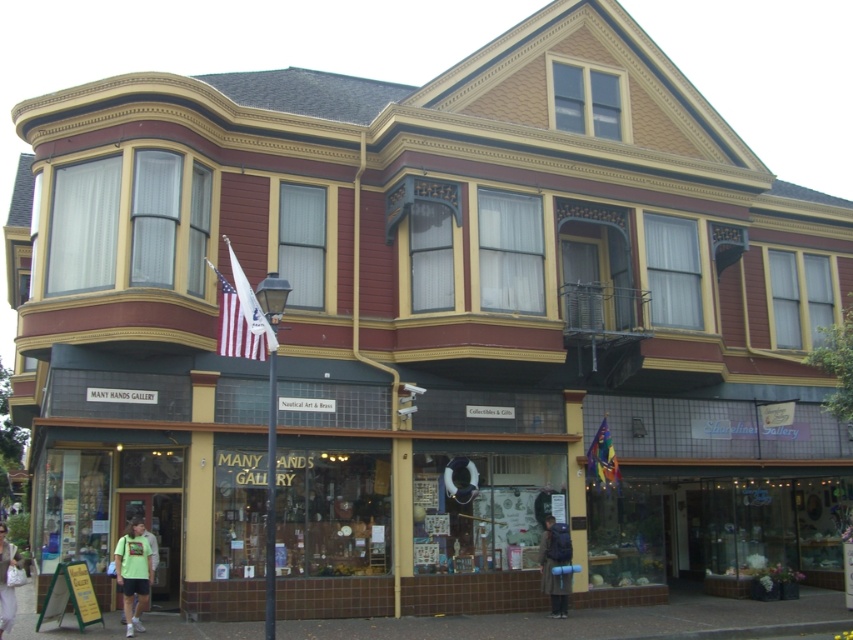
Can you confirm if light green t-shirt at lower left is taller than dark brown backpack at lower right?

In fact, light green t-shirt at lower left may be shorter than dark brown backpack at lower right.

Which is behind, point (119, 550) or point (569, 548)?

Positioned behind is point (569, 548).

Find the location of `light green t-shirt at lower left`. light green t-shirt at lower left is located at coordinates (132, 572).

Is rainbow fabric flag at center further to the viewer compared to green fabric bag at lower left?

Yes, it is behind green fabric bag at lower left.

Who is more forward, (x=590, y=460) or (x=0, y=596)?

Point (x=0, y=596)

Who is more forward, (599,472) or (6,604)?

Point (6,604) is in front.

I want to click on rainbow fabric flag at center, so click(602, 458).

Is light green t-shirt at lower left further to the viewer compared to rainbow fabric flag at center?

No, light green t-shirt at lower left is in front of rainbow fabric flag at center.

Does light green t-shirt at lower left have a lesser height compared to rainbow fabric flag at center?

Incorrect, light green t-shirt at lower left's height does not fall short of rainbow fabric flag at center's.

Who is more forward, [132,573] or [619,476]?

Point [132,573] is in front.

Locate an element on the screen. light green t-shirt at lower left is located at coordinates (132, 572).